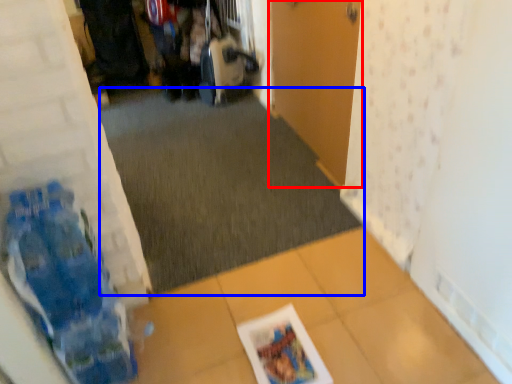
Question: Which object is further to the camera taking this photo, door (highlighted by a red box) or plain (highlighted by a blue box)?

Choices:
 (A) door
 (B) plain

Answer: (B)